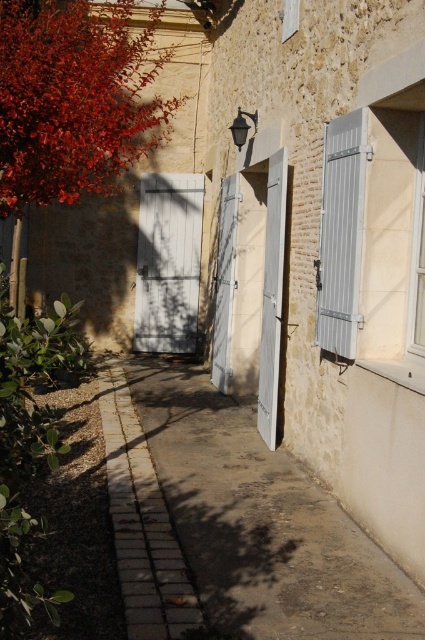
Question: Can you confirm if bright red leaves at left is positioned to the right of white wood door at center?

Choices:
 (A) yes
 (B) no

Answer: (B)

Question: Which object is farther from the camera taking this photo?

Choices:
 (A) white matte door at center
 (B) paved stone path at center
 (C) paved concrete sidewalk at center
 (D) metallic gray shutter at right

Answer: (A)

Question: Which point is farther to the camera?

Choices:
 (A) paved stone path at center
 (B) white matte door at center

Answer: (B)

Question: Which is farther from the white painted wood door at center?

Choices:
 (A) paved concrete sidewalk at center
 (B) metallic gray shutter at right

Answer: (A)

Question: Does white matte door at center appear on the left side of metallic gray shutter at right?

Choices:
 (A) yes
 (B) no

Answer: (A)

Question: Is paved concrete sidewalk at center to the right of bright red leaves at left from the viewer's perspective?

Choices:
 (A) no
 (B) yes

Answer: (B)